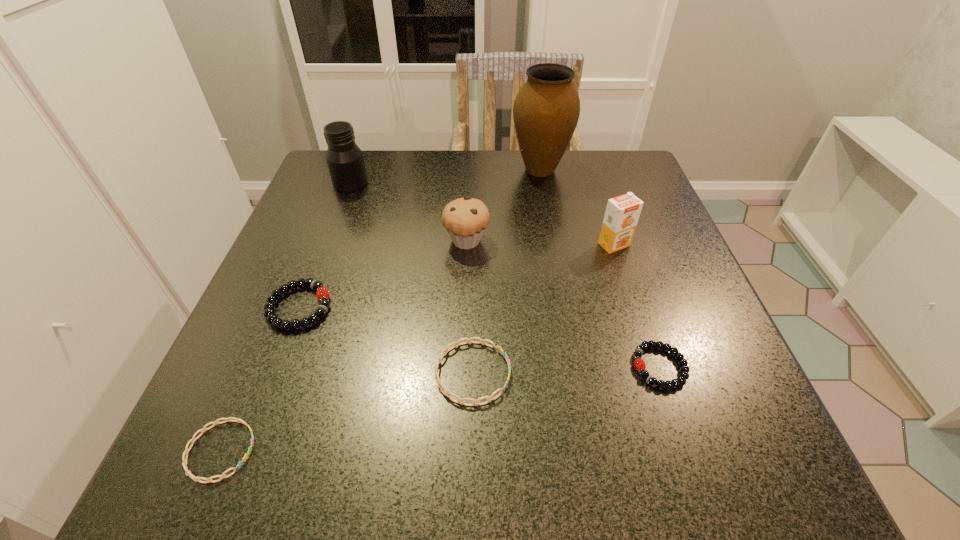
This screenshot has width=960, height=540. What are the coordinates of `the tallest object` in the screenshot? It's located at (546, 110).

At what (x,y) coordinates should I click in order to perform the action: click on brown urn. Please return your answer as a coordinate pair (x, y). Image resolution: width=960 pixels, height=540 pixels. Looking at the image, I should click on (546, 110).

The width and height of the screenshot is (960, 540). Find the location of `jar`. jar is located at coordinates (344, 158).

The height and width of the screenshot is (540, 960). I want to click on orange orange juice, so click(622, 213).

You are a GUI agent. You are given a task and a screenshot of the screen. Output one action in this format:
    pyautogui.click(x=<x>, y=<y>)
    Task: Click on the third tallest object
    
    Given the screenshot: What is the action you would take?
    pyautogui.click(x=622, y=213)

This screenshot has width=960, height=540. I want to click on muffin, so click(465, 219).

I want to click on the fifth farthest object, so click(x=322, y=293).

In order to click on the bigger black bracelet in this screenshot , I will do `click(322, 293)`.

Identify the location of the bigger blue bracelet. (460, 400).

At what (x,y) coordinates should I click in order to perform the action: click on the farther blue bracelet. Please return your answer as a coordinate pair (x, y). The height and width of the screenshot is (540, 960). Looking at the image, I should click on (460, 400).